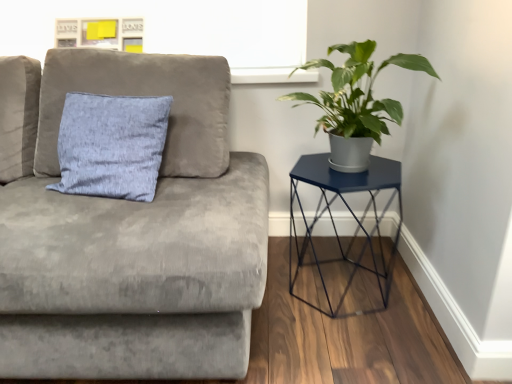
Question: Considering the relative sizes of green matte plant at right and metallic blue hexagonal table at right in the image provided, is green matte plant at right thinner than metallic blue hexagonal table at right?

Choices:
 (A) yes
 (B) no

Answer: (A)

Question: From the image's perspective, is green matte plant at right beneath metallic blue hexagonal table at right?

Choices:
 (A) yes
 (B) no

Answer: (B)

Question: Does green matte plant at right turn towards metallic blue hexagonal table at right?

Choices:
 (A) no
 (B) yes

Answer: (A)

Question: From the image's perspective, is green matte plant at right located above metallic blue hexagonal table at right?

Choices:
 (A) no
 (B) yes

Answer: (B)

Question: Does green matte plant at right have a greater width compared to metallic blue hexagonal table at right?

Choices:
 (A) no
 (B) yes

Answer: (A)

Question: Based on their sizes in the image, would you say velvet gray couch at upper left is bigger or smaller than green matte plant at right?

Choices:
 (A) big
 (B) small

Answer: (A)

Question: From the image's perspective, is velvet gray couch at upper left above or below green matte plant at right?

Choices:
 (A) above
 (B) below

Answer: (B)

Question: Considering the positions of velvet gray couch at upper left and green matte plant at right in the image, is velvet gray couch at upper left taller or shorter than green matte plant at right?

Choices:
 (A) short
 (B) tall

Answer: (B)

Question: Is velvet gray couch at upper left wider or thinner than green matte plant at right?

Choices:
 (A) thin
 (B) wide

Answer: (B)

Question: Visually, is green matte plant at right positioned to the left or to the right of metallic blue hexagonal table at right?

Choices:
 (A) left
 (B) right

Answer: (A)

Question: From the image's perspective, is green matte plant at right positioned above or below metallic blue hexagonal table at right?

Choices:
 (A) above
 (B) below

Answer: (A)

Question: In terms of size, does green matte plant at right appear bigger or smaller than metallic blue hexagonal table at right?

Choices:
 (A) big
 (B) small

Answer: (B)

Question: Do you think green matte plant at right is within metallic blue hexagonal table at right, or outside of it?

Choices:
 (A) inside
 (B) outside

Answer: (B)

Question: Is velvet gray couch at upper left bigger or smaller than metallic blue hexagonal table at right?

Choices:
 (A) small
 (B) big

Answer: (B)

Question: Considering the relative positions of velvet gray couch at upper left and metallic blue hexagonal table at right in the image provided, is velvet gray couch at upper left to the left or to the right of metallic blue hexagonal table at right?

Choices:
 (A) left
 (B) right

Answer: (A)